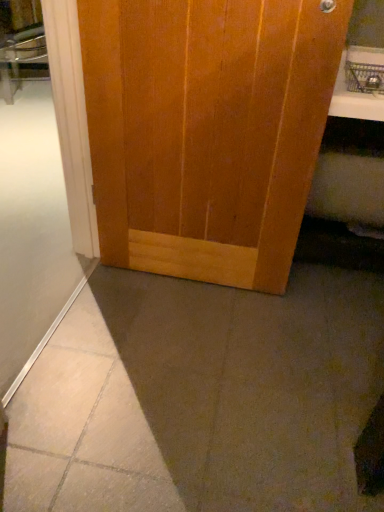
Measure the distance between point (130,30) and camera.

A distance of 1.11 meters exists between point (130,30) and camera.

Locate an element on the screen. The width and height of the screenshot is (384, 512). white frosted glass at lower left is located at coordinates (31, 210).

Locate an element on the screen. This screenshot has width=384, height=512. wooden door at center is located at coordinates (207, 130).

From a real-world perspective, is white frosted glass at lower left positioned above or below wooden door at center?

Clearly, from a real-world perspective, white frosted glass at lower left is below wooden door at center.

Is the position of white frosted glass at lower left less distant than that of wooden door at center?

Yes, white frosted glass at lower left is in front of wooden door at center.

Considering the sizes of objects white frosted glass at lower left and wooden door at center in the image provided, who is wider, white frosted glass at lower left or wooden door at center?

white frosted glass at lower left.

Considering the sizes of objects white frosted glass at lower left and wooden door at center in the image provided, who is smaller, white frosted glass at lower left or wooden door at center?

wooden door at center.

How much distance is there between wooden door at center and white frosted glass at lower left?

wooden door at center is 77.56 centimeters from white frosted glass at lower left.

From the image's perspective, is wooden door at center located above white frosted glass at lower left?

Yes.

Considering the positions of objects wooden door at center and white frosted glass at lower left in the image provided, who is behind, wooden door at center or white frosted glass at lower left?

wooden door at center is more distant.

Considering the sizes of objects wooden door at center and white frosted glass at lower left in the image provided, who is wider, wooden door at center or white frosted glass at lower left?

Wider between the two is white frosted glass at lower left.

From a real-world perspective, who is located lower, white glossy counter top at upper right or wooden door at center?

In real-world perspective, wooden door at center is lower.

Is white glossy counter top at upper right further to the viewer compared to wooden door at center?

Yes, it is.

Is white glossy counter top at upper right far from wooden door at center?

Actually, white glossy counter top at upper right and wooden door at center are a little close together.

Considering the positions of objects white glossy counter top at upper right and wooden door at center in the image provided, who is more to the right, white glossy counter top at upper right or wooden door at center?

From the viewer's perspective, white glossy counter top at upper right appears more on the right side.

Based on the photo, does white frosted glass at lower left turn towards white glossy counter top at upper right?

Yes, white frosted glass at lower left is aimed at white glossy counter top at upper right.

This screenshot has height=512, width=384. In order to click on counter top to the right of white frosted glass at lower left in this screenshot , I will do `click(357, 86)`.

What's the angular difference between white frosted glass at lower left and white glossy counter top at upper right's facing directions?

92.9 degrees separate the facing orientations of white frosted glass at lower left and white glossy counter top at upper right.

Consider the image. From a real-world perspective, which is physically below, wooden door at center or white glossy counter top at upper right?

wooden door at center.

Can you confirm if wooden door at center is smaller than white glossy counter top at upper right?

No, wooden door at center is not smaller than white glossy counter top at upper right.

Are wooden door at center and white glossy counter top at upper right beside each other?

There is a gap between wooden door at center and white glossy counter top at upper right.

Image resolution: width=384 pixels, height=512 pixels. Find the location of `door in front of the white glossy counter top at upper right`. door in front of the white glossy counter top at upper right is located at coordinates (207, 130).

Consider the image. Which is closer, (x=336, y=81) or (x=11, y=145)?

The point (x=336, y=81) is closer.

From the image's perspective, is white glossy counter top at upper right over white frosted glass at lower left?

Yes, from the image's perspective, white glossy counter top at upper right is on top of white frosted glass at lower left.

Consider the image. Is white glossy counter top at upper right far away from white frosted glass at lower left?

Yes.

Is white glossy counter top at upper right oriented towards white frosted glass at lower left?

No, white glossy counter top at upper right does not turn towards white frosted glass at lower left.

Identify the location of shower door that is below the wooden door at center (from the image's perspective). The width and height of the screenshot is (384, 512). (31, 210).

The width and height of the screenshot is (384, 512). I want to click on shower door lying in front of the wooden door at center, so click(x=31, y=210).

Considering their positions, is white glossy counter top at upper right positioned further to white frosted glass at lower left than wooden door at center?

white glossy counter top at upper right lies further to white frosted glass at lower left than the other object.

Estimate the real-world distances between objects in this image. Which object is further from wooden door at center, white frosted glass at lower left or white glossy counter top at upper right?

white glossy counter top at upper right is further to wooden door at center.

Looking at this image, which object lies further to the anchor point white glossy counter top at upper right, white frosted glass at lower left or wooden door at center?

Based on the image, white frosted glass at lower left appears to be further to white glossy counter top at upper right.

Which object lies nearer to the anchor point white frosted glass at lower left, wooden door at center or white glossy counter top at upper right?

Based on the image, wooden door at center appears to be nearer to white frosted glass at lower left.

Estimate the real-world distances between objects in this image. Which object is further from white glossy counter top at upper right, wooden door at center or white frosted glass at lower left?

Based on the image, white frosted glass at lower left appears to be further to white glossy counter top at upper right.

Estimate the real-world distances between objects in this image. Which object is further from wooden door at center, white glossy counter top at upper right or white frosted glass at lower left?

white glossy counter top at upper right is positioned further to the anchor wooden door at center.

Locate an element on the screen. Image resolution: width=384 pixels, height=512 pixels. door between white frosted glass at lower left and white glossy counter top at upper right from left to right is located at coordinates (207, 130).